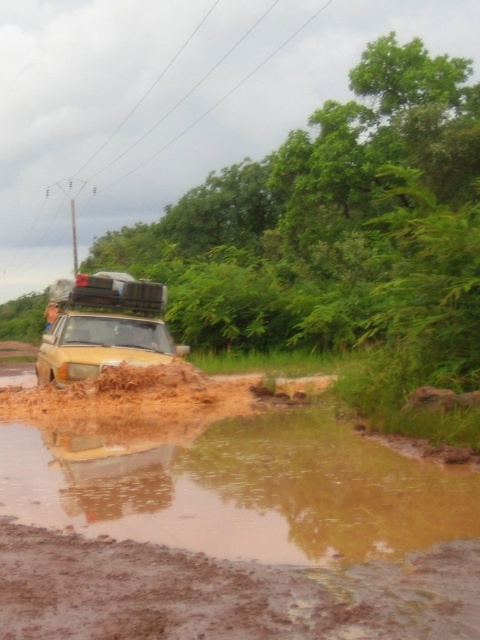
You are a passenger in the yellow matte car at center driving along the brown muddy dirt track at lower center. The driver wants to pull over to the side of the road to let another vehicle pass. Which side should they move to?

The driver should move to the right side of the yellow matte car at center because the brown muddy dirt track at lower center is on the right side of the car, allowing them to pull over safely.

You are a GPS device trying to navigate a driver to the brown muddy dirt track at lower center. What coordinates should you provide to the driver?

The coordinates for the brown muddy dirt track at lower center are at point (226, 593).

You are a hiker trying to cross the muddy road in the image. There is a point marked at coordinates (226,593). What is located at that point?

The point at coordinates (226,593) is occupied by the brown muddy dirt track at lower center.